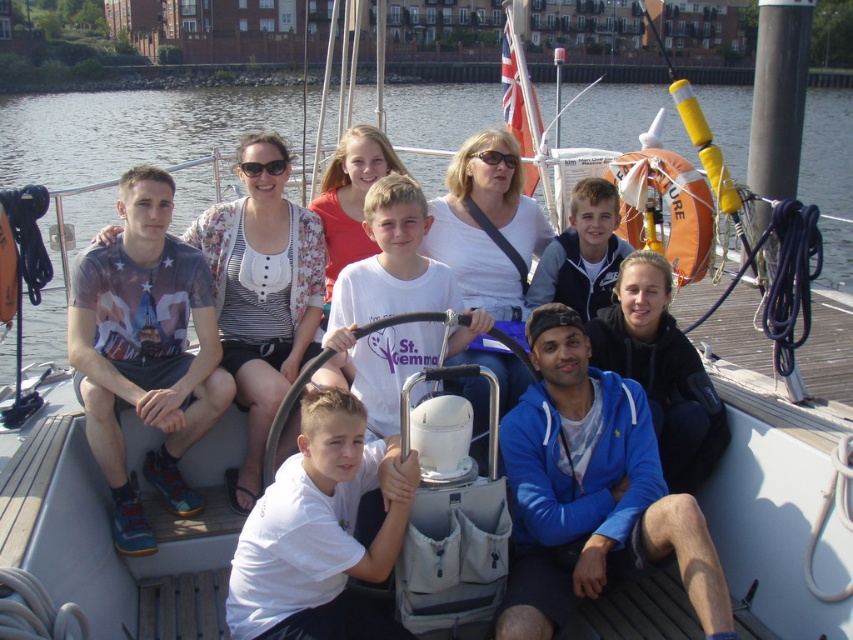
Is the position of printed cotton t-shirt at left more distant than that of white matte shirt at center?

Yes, printed cotton t-shirt at left is behind white matte shirt at center.

The width and height of the screenshot is (853, 640). Describe the element at coordinates (144, 352) in the screenshot. I see `printed cotton t-shirt at left` at that location.

Which is in front, point (132, 182) or point (326, 493)?

Point (326, 493) is more forward.

Locate an element on the screen. This screenshot has width=853, height=640. printed cotton t-shirt at left is located at coordinates (144, 352).

Is point (293, 104) behind point (132, 292)?

Yes, point (293, 104) is behind point (132, 292).

Is point (273, 100) more distant than point (112, 321)?

Yes, it is behind point (112, 321).

You are a GUI agent. You are given a task and a screenshot of the screen. Output one action in this format:
    pyautogui.click(x=<x>, y=<y>)
    Task: Click on the clear water at upper left
    The image size is (853, 640).
    Given the screenshot: What is the action you would take?
    pyautogui.click(x=131, y=129)

Does point (601, 396) come closer to viewer compared to point (373, 554)?

No, it is not.

Who is positioned more to the left, blue fleece jacket at lower right or white matte shirt at center?

white matte shirt at center

Which is in front, point (561, 486) or point (399, 476)?

Point (399, 476) is more forward.

Find the location of a particular element. The width and height of the screenshot is (853, 640). blue fleece jacket at lower right is located at coordinates (590, 492).